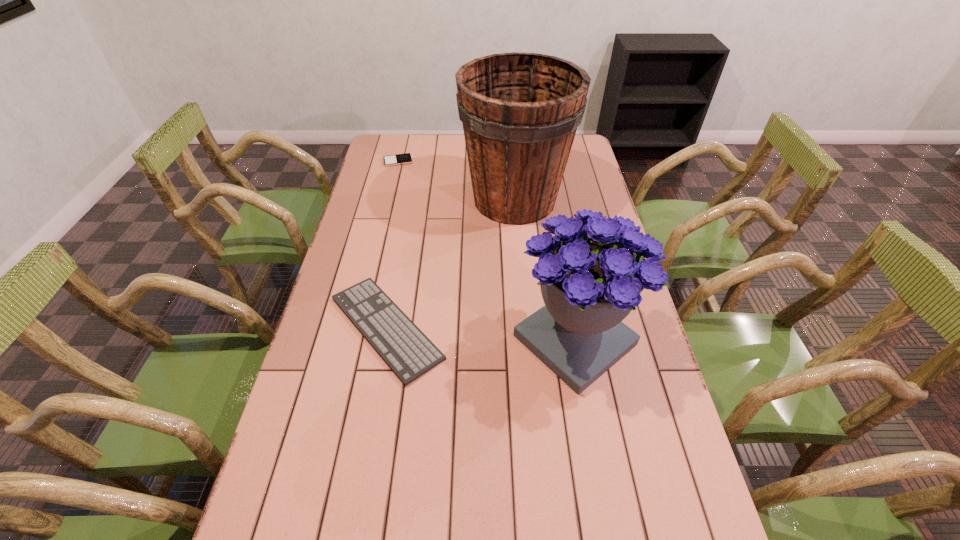
This screenshot has height=540, width=960. Find the location of `computer keyboard that is positioned at the left edge`. computer keyboard that is positioned at the left edge is located at coordinates (409, 353).

Where is `iPod at the left edge`? This screenshot has height=540, width=960. iPod at the left edge is located at coordinates (399, 159).

Identify the location of bucket present at the right edge. (520, 111).

At what (x,y) coordinates should I click in order to perform the action: click on bouquet at the right edge. Please return your answer as a coordinate pair (x, y). This screenshot has width=960, height=540. Looking at the image, I should click on (591, 273).

At what (x,y) coordinates should I click in order to perform the action: click on object that is at the far left corner. Please return your answer as a coordinate pair (x, y). This screenshot has height=540, width=960. Looking at the image, I should click on (399, 159).

Where is `blank space at the far edge`? The height and width of the screenshot is (540, 960). blank space at the far edge is located at coordinates (427, 148).

Identify the location of vacant space at the left edge of the desktop. coord(379,180).

Image resolution: width=960 pixels, height=540 pixels. What are the coordinates of `free point at the right edge` in the screenshot? It's located at (657, 512).

Locate an element on the screen. The width and height of the screenshot is (960, 540). free space at the far left corner of the desktop is located at coordinates (382, 156).

Image resolution: width=960 pixels, height=540 pixels. In the image, there is a desktop. Find the location of `vacant space at the far right corner`. vacant space at the far right corner is located at coordinates (574, 149).